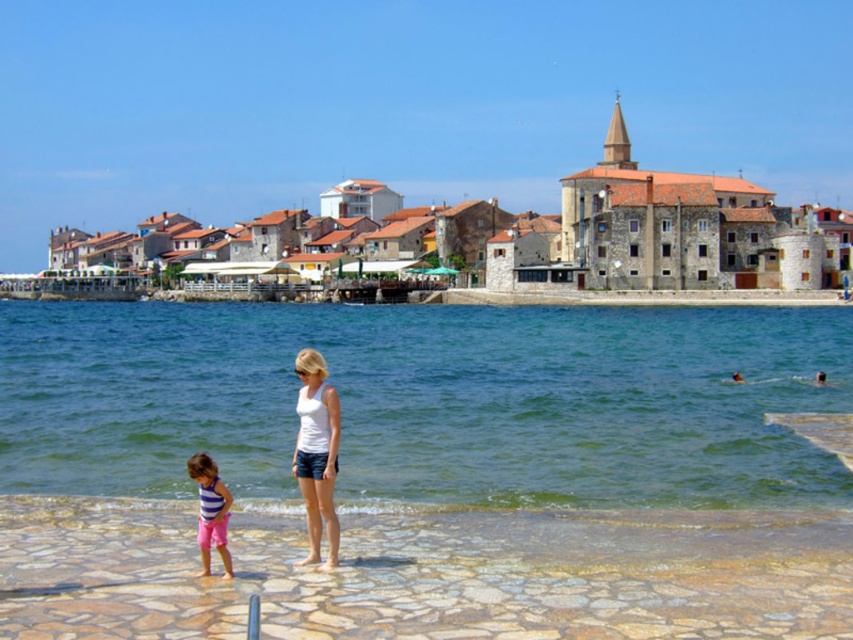
You are a photographer standing at the edge of the coastal scene. You want to capture a photo of the white matte tank top at center without the clear blue water at lower center appearing in the foreground. Is this possible based on their positions?

The clear blue water at lower center is located above the white matte tank top at center, so it is positioned in front of the tank top. To avoid the water appearing in the foreground, you would need to adjust your angle or position to frame the tank top without the water obstructing the view.

You are standing at the paved area with irregularly shaped stones and want to take a photo of both the point at coordinates point (572, 496) and point (196, 472). Which point should you focus on first to ensure both are in the frame?

You should focus on point (572, 496) first because it is closer to the camera, ensuring both points are within the frame.

You are standing at the point marked by the coordinates point (701, 348) in the coastal scene. If you want to swim towards the open water, which direction should you head? Please consider the layout of the coastal scene described.

The point (701, 348) is 96.95 meters away from the viewer. Since the middle ground has calm turquoise waters lapping against the shore, swimming towards the open water would require heading away from the shore towards deeper waters. However, the exact direction depends on the coastal layout, but based on typical coastal scenes, moving towards the middle ground area described would lead towards the open water.